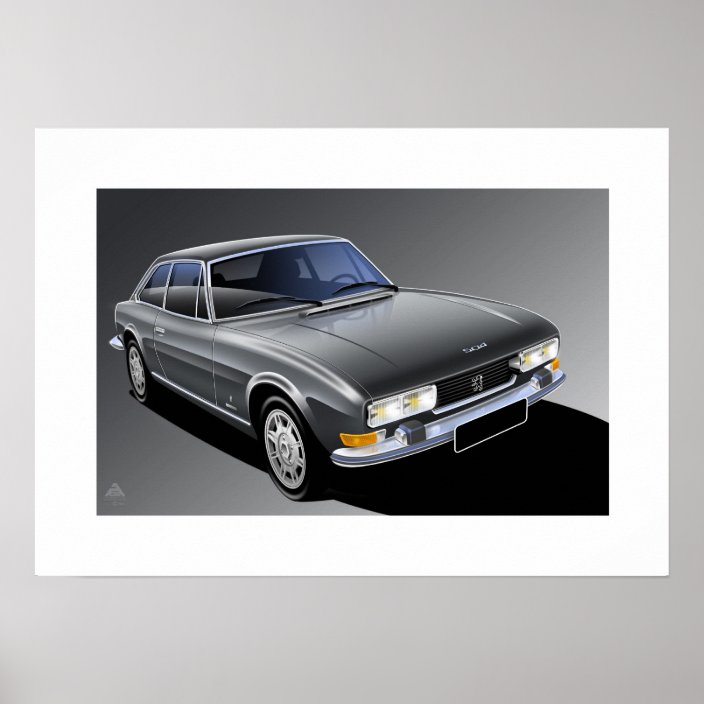
Find the location of a particular element. light is located at coordinates (364, 440).